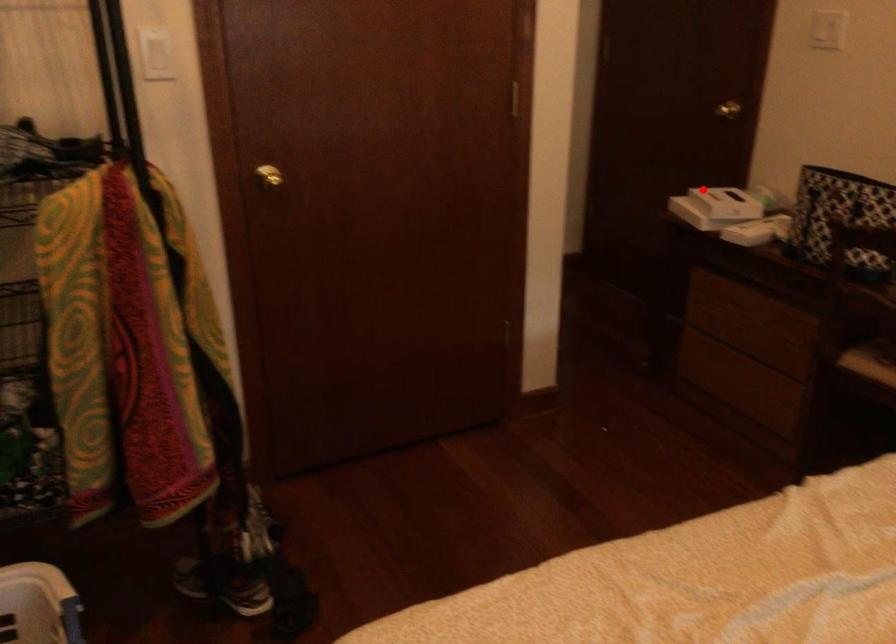
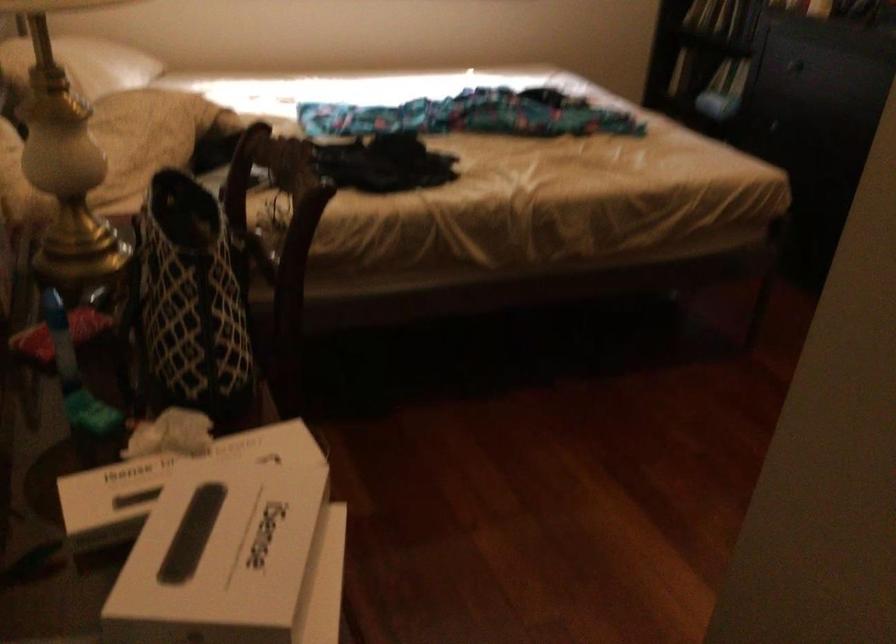
Where in the second image is the point corresponding to the highlighted location from the first image?

(234, 560)